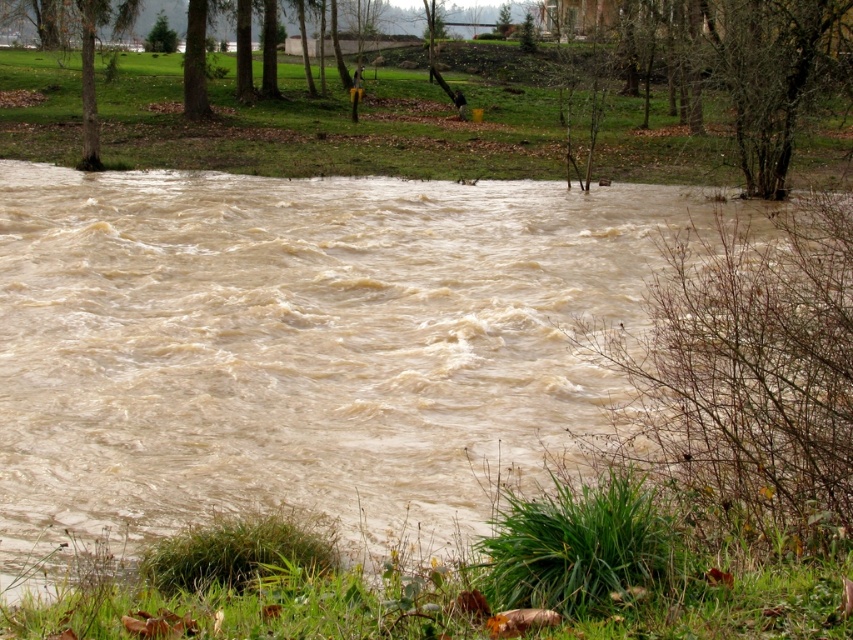
You are a hiker trying to cross the flooded area. You see the brown muddy water at center and the green matte tree at upper left. Which direction should you head towards to avoid the water?

The brown muddy water at center is positioned on the right side of green matte tree at upper left. To avoid the water, you should head towards the left side of the green matte tree at upper left.

You are standing on the grassy bank and see the point marked at coordinates (302, 346). Based on the scene description, where is this point located?

The point is located on the brown muddy water at center.

You are standing on the grassy bank in the foreground of the flooded area. You need to cross to the middle ground where the trees are. The brown muddy water at center is in your way. Can you step over it?

The brown muddy water at center is located at coordinates point (x=302, y=346), so you cannot step over it because it is a continuous body of water covering the area between you and the middle ground trees.